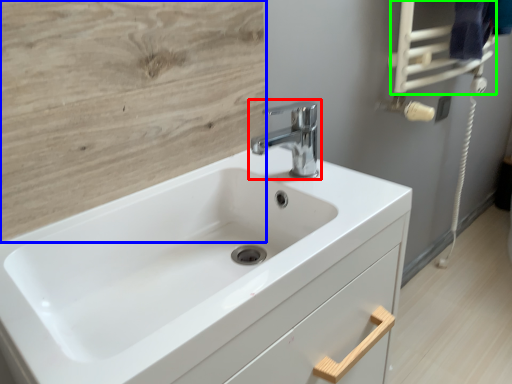
Question: Which is farther away from tap (highlighted by a red box)? plywood (highlighted by a blue box) or towel bar (highlighted by a green box)?

Choices:
 (A) plywood
 (B) towel bar

Answer: (B)